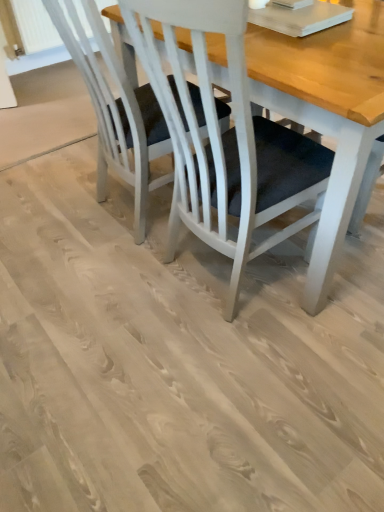
Question: Which is correct: white painted wood chair at center is inside wooden table at center, or outside of it?

Choices:
 (A) inside
 (B) outside

Answer: (B)

Question: In terms of size, does white painted wood chair at center appear bigger or smaller than wooden table at center?

Choices:
 (A) small
 (B) big

Answer: (B)

Question: Considering their positions, is white painted wood chair at center located in front of or behind wooden table at center?

Choices:
 (A) front
 (B) behind

Answer: (B)

Question: Is wooden table at center inside or outside of white painted wood chair at center?

Choices:
 (A) outside
 (B) inside

Answer: (A)

Question: Considering their positions, is wooden table at center located in front of or behind white painted wood chair at center?

Choices:
 (A) front
 (B) behind

Answer: (A)

Question: Considering the relative positions of wooden table at center and white painted wood chair at center in the image provided, is wooden table at center to the left or to the right of white painted wood chair at center?

Choices:
 (A) right
 (B) left

Answer: (A)

Question: In terms of height, does wooden table at center look taller or shorter compared to white painted wood chair at center?

Choices:
 (A) short
 (B) tall

Answer: (B)